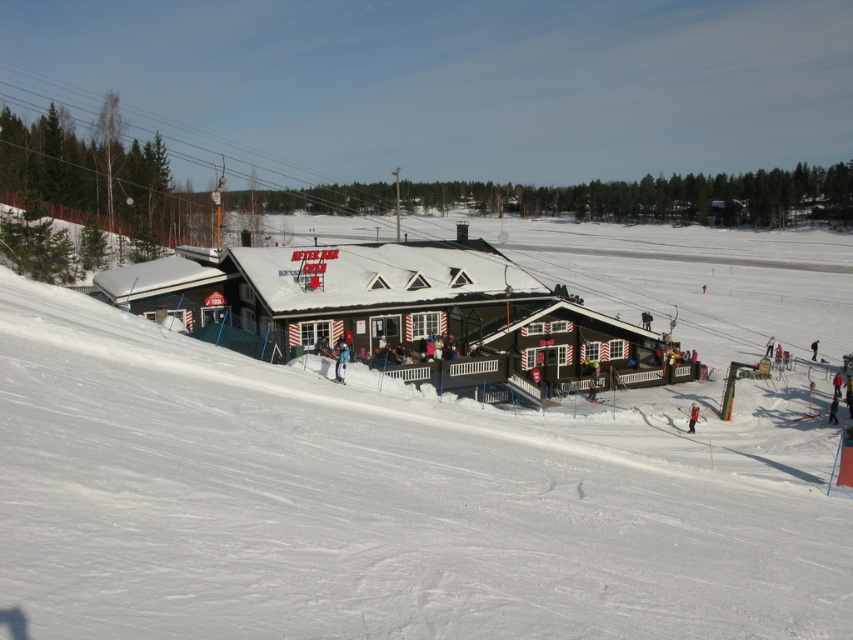
Question: Does blue denim jacket at center come behind red ski suit at center?

Choices:
 (A) yes
 (B) no

Answer: (B)

Question: Which object is positioned closest to the white powdery snow at center?

Choices:
 (A) blue denim jacket at center
 (B) brown wooden ski resort at center

Answer: (B)

Question: Is white powdery snow at center wider than red ski suit at center?

Choices:
 (A) yes
 (B) no

Answer: (A)

Question: Among these points, which one is nearest to the camera?

Choices:
 (A) (296, 275)
 (B) (648, 540)
 (C) (340, 380)

Answer: (B)

Question: Among these objects, which one is nearest to the camera?

Choices:
 (A) brown wooden ski resort at center
 (B) white powdery snow at center
 (C) blue denim jacket at center
 (D) red ski suit at center

Answer: (B)

Question: From the image, what is the correct spatial relationship of white powdery snow at center in relation to blue denim jacket at center?

Choices:
 (A) left
 (B) right

Answer: (B)